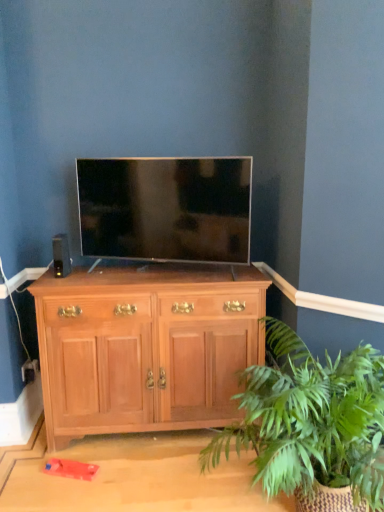
The image size is (384, 512). What are the coordinates of `free space to the right of black matte speaker at left` in the screenshot? It's located at (95, 271).